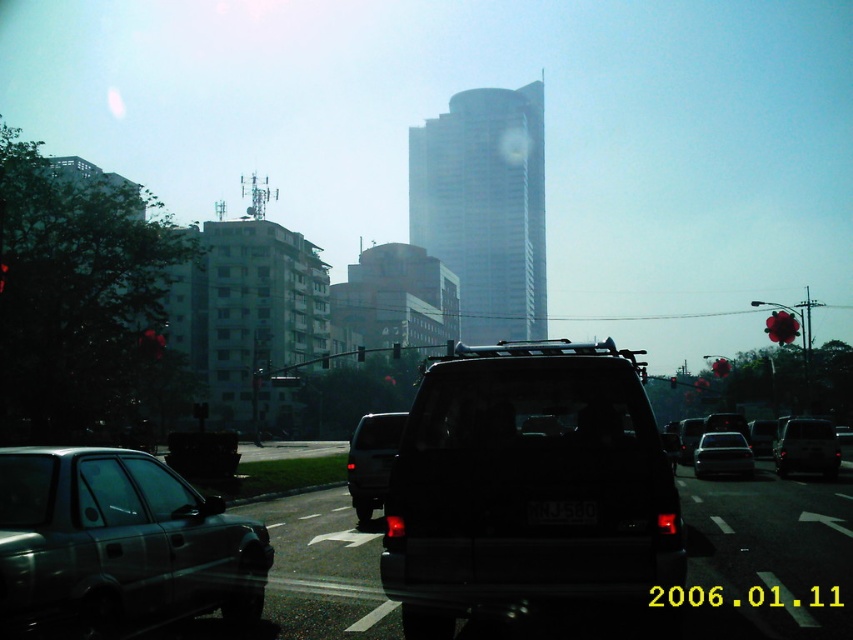
You are a pedestrian standing at the crosswalk and see the satin silver suv at lower left and the satin black suv at center. Which vehicle is closer to you?

The satin silver suv at lower left is closer to you because it is in front of the satin black suv at center.

You are driving a car and see the red plastic traffic light at right and the black plastic traffic light at center. Which traffic light is closer to you?

The red plastic traffic light at right is closer to you because it is in front of the black plastic traffic light at center.

You are standing at the camera position and want to cross the street to reach the shiny black suv at center. The road has a speed limit of 30 km per hour. Can you safely cross the road before the vehicles arrive? Please consider the distance between you and the SUV and the speed limit.

The shiny black suv at center is 26.91 meters away from the camera. Considering the speed limit of 30 km per hour, you have approximately 3.2 seconds before the SUV reaches your position. Whether you can safely cross depends on your walking speed and the distance to the road, but the time window is tight. Proceed with caution and check for oncoming traffic.